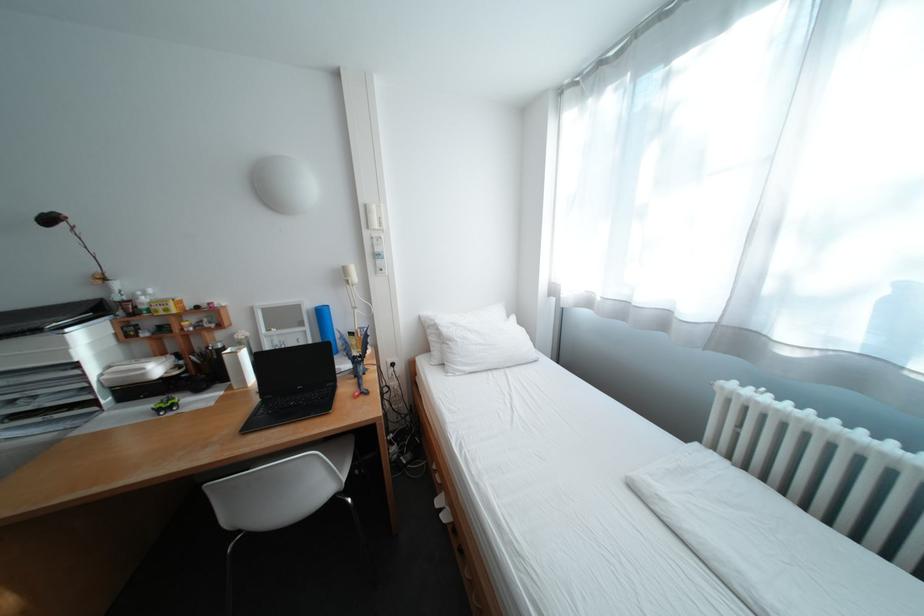
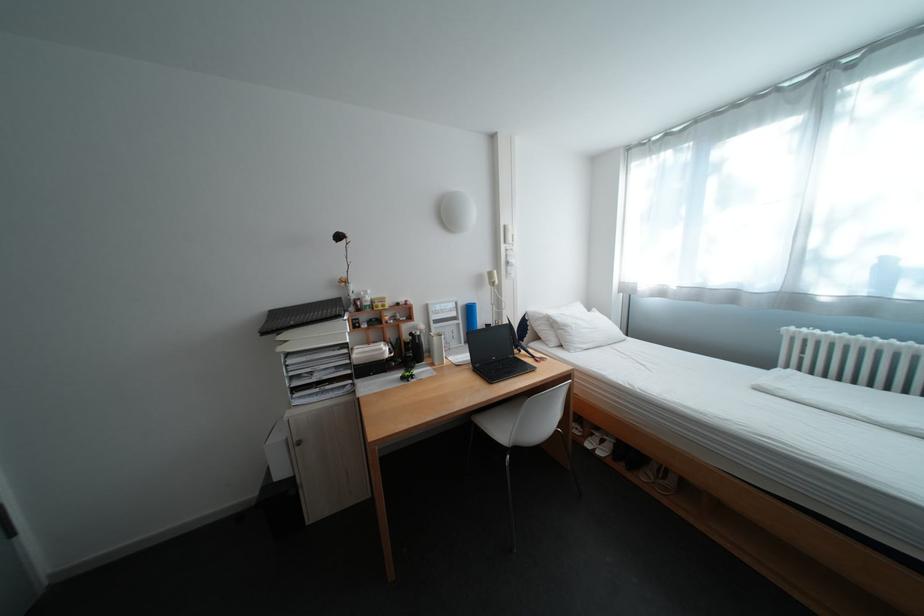
Question: What movement of the cameraman would produce the second image?

Choices:
 (A) Left
 (B) Right
 (C) Forward
 (D) Backward

Answer: (A)